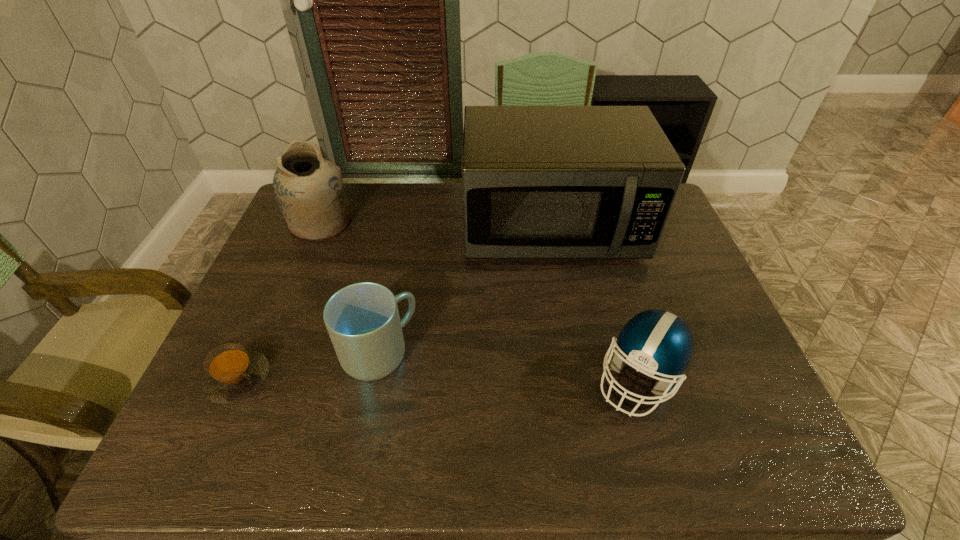
Where is `microwave oven positioned at the far edge`? microwave oven positioned at the far edge is located at coordinates (538, 182).

Find the location of a particular element. The width and height of the screenshot is (960, 540). pottery that is at the far edge is located at coordinates (308, 189).

Identify the location of pottery at the left edge. The image size is (960, 540). (308, 189).

Where is `cappuccino that is at the left edge`? This screenshot has width=960, height=540. cappuccino that is at the left edge is located at coordinates (233, 373).

Where is `microwave oven present at the right edge`? The width and height of the screenshot is (960, 540). microwave oven present at the right edge is located at coordinates (538, 182).

Locate an element on the screen. football helmet present at the right edge is located at coordinates (655, 342).

At what (x,y) coordinates should I click in order to perform the action: click on object located in the far left corner section of the desktop. Please return your answer as a coordinate pair (x, y). This screenshot has width=960, height=540. Looking at the image, I should click on (308, 189).

The width and height of the screenshot is (960, 540). I want to click on object that is at the far right corner, so click(538, 182).

Identify the location of vacant position at the far edge of the desktop. (458, 215).

This screenshot has height=540, width=960. I want to click on vacant space at the near edge of the desktop, so click(305, 463).